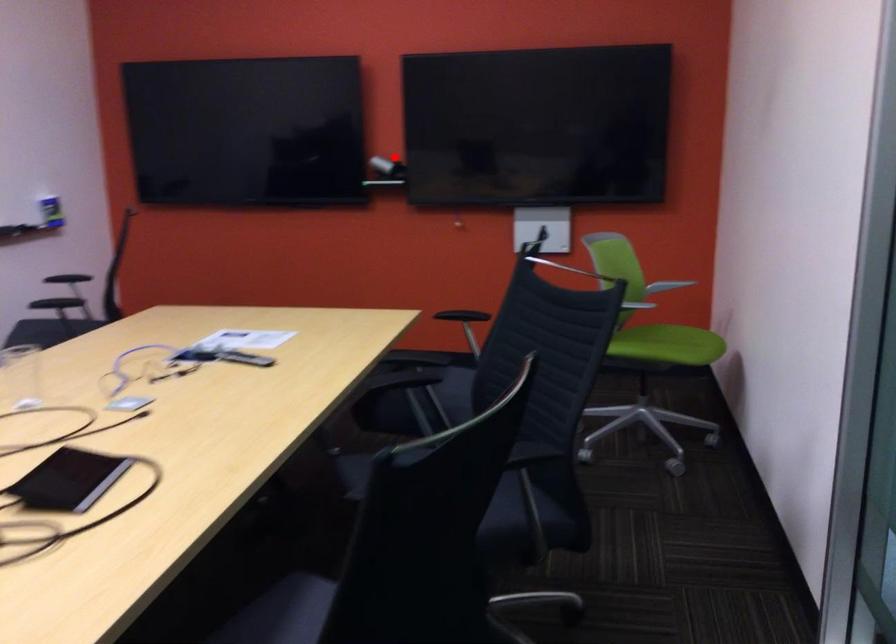
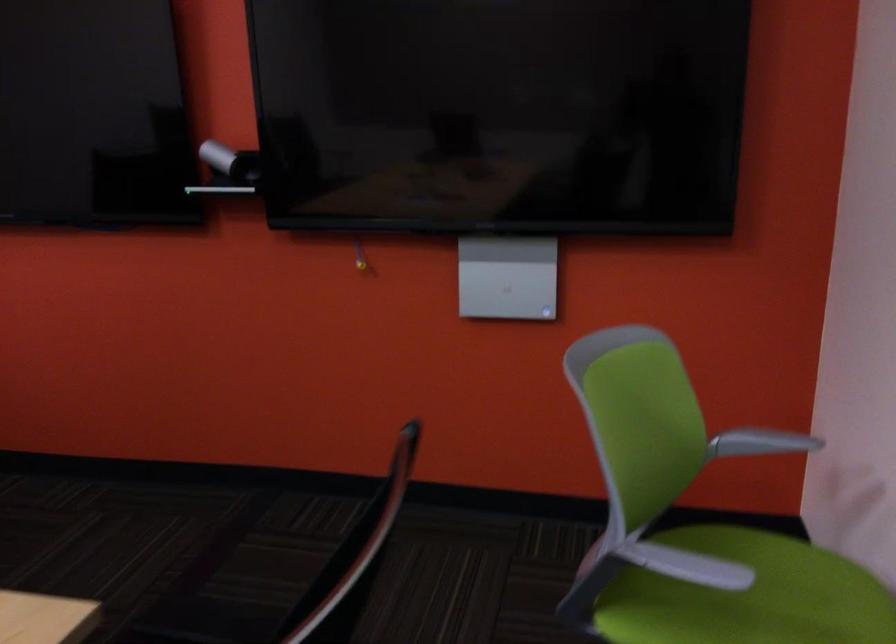
Question: I am providing you with two images of the same scene from different viewpoints. Given a red point in image1, look at the same physical point in image2. Is it:

Choices:
 (A) Closer to the viewpoint
 (B) Farther from the viewpoint

Answer: (A)